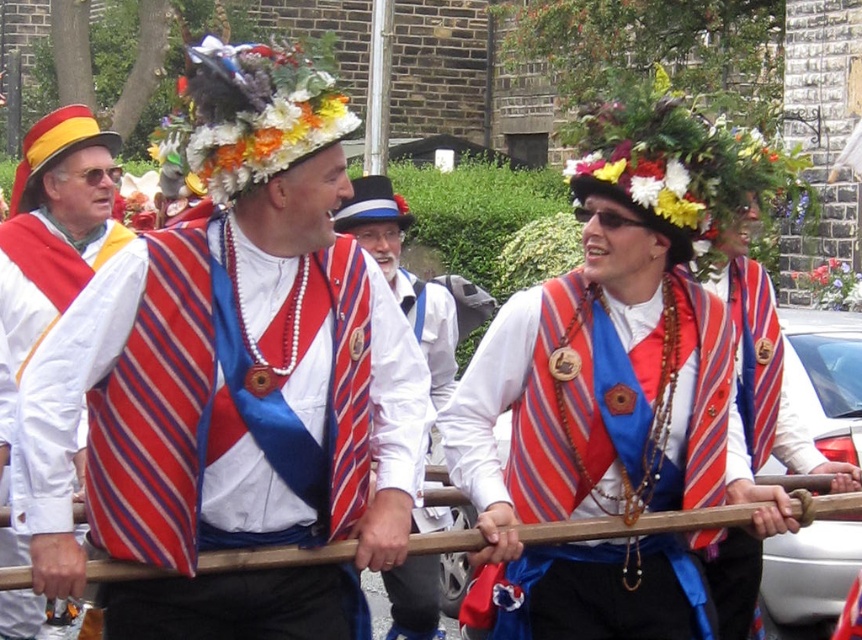
You are organizing a costume party and need to decide which vest to wear. You have two options in front of you. The first is the matte fabric vest at center, and the second is the matte red vest at center. Which vest is bigger in size?

The matte fabric vest at center is larger in size compared to the matte red vest at center.

You are standing in the middle of the celebration and want to move towards the two points marked in the scene. Which point, point [42,276] or point [416,566], will you reach first?

You will reach point [42,276] first because it is closer to you than point [416,566], which is further away.